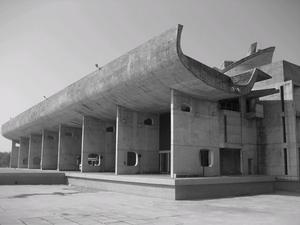
This screenshot has width=300, height=225. Identify the location of walls. (196, 133), (131, 121), (97, 129), (70, 133), (51, 140), (35, 141), (21, 143), (16, 147).